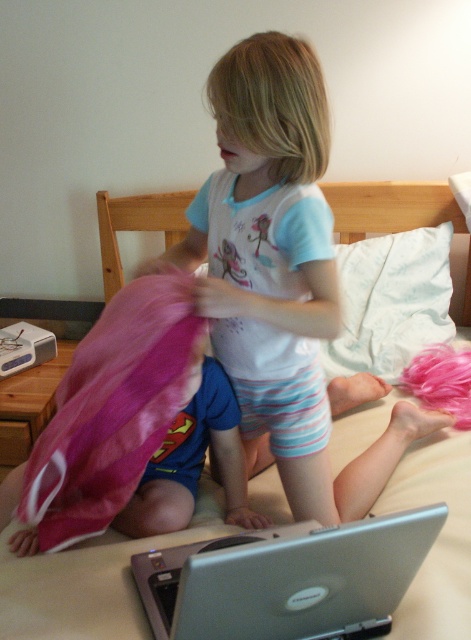
The child is holding a bright pink fabric item. Which object in the scene is taller, the silver metallic laptop at lower center or the white soft pillow at upper center?

The white soft pillow at upper center is taller than the silver metallic laptop at lower center.